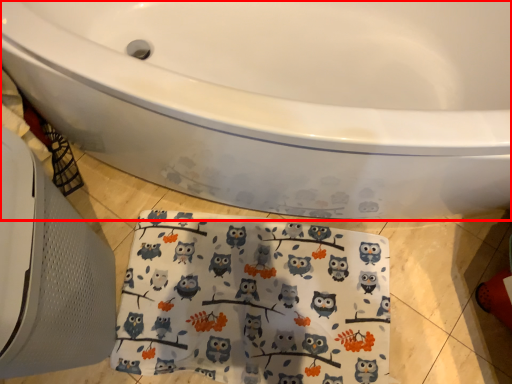
Question: Observing the image, what is the correct spatial positioning of bathtub (annotated by the red box) in reference to beach towel?

Choices:
 (A) left
 (B) right

Answer: (B)